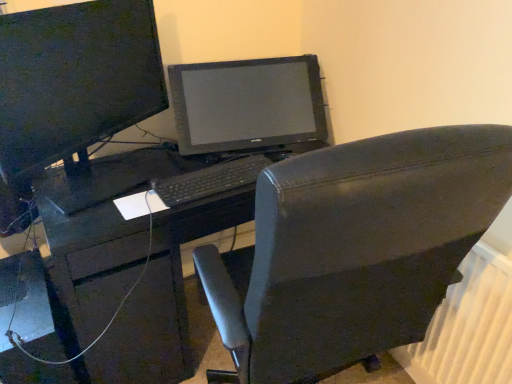
Question: Considering the relative sizes of matte black monitor at upper left and matte black desk at center in the image provided, is matte black monitor at upper left wider than matte black desk at center?

Choices:
 (A) no
 (B) yes

Answer: (A)

Question: Is matte black monitor at upper left positioned beyond the bounds of matte black desk at center?

Choices:
 (A) yes
 (B) no

Answer: (A)

Question: Is matte black monitor at upper left closer to the viewer compared to matte black desk at center?

Choices:
 (A) yes
 (B) no

Answer: (A)

Question: Considering the relative positions of matte black monitor at upper left and matte black desk at center in the image provided, is matte black monitor at upper left to the right of matte black desk at center from the viewer's perspective?

Choices:
 (A) yes
 (B) no

Answer: (B)

Question: Is matte black monitor at upper left taller than matte black desk at center?

Choices:
 (A) no
 (B) yes

Answer: (A)

Question: Is matte black monitor at upper left to the left or to the right of black plastic keyboard at center in the image?

Choices:
 (A) right
 (B) left

Answer: (B)

Question: Looking at their shapes, would you say matte black monitor at upper left is wider or thinner than black plastic keyboard at center?

Choices:
 (A) wide
 (B) thin

Answer: (A)

Question: Is matte black monitor at upper left inside or outside of black plastic keyboard at center?

Choices:
 (A) inside
 (B) outside

Answer: (B)

Question: Does point (158, 112) appear closer or farther from the camera than point (226, 183)?

Choices:
 (A) closer
 (B) farther

Answer: (B)

Question: Looking at the image, does black plastic keyboard at center seem bigger or smaller compared to black leather chair at center?

Choices:
 (A) small
 (B) big

Answer: (A)

Question: In terms of width, does black plastic keyboard at center look wider or thinner when compared to black leather chair at center?

Choices:
 (A) wide
 (B) thin

Answer: (B)

Question: Which is correct: black plastic keyboard at center is inside black leather chair at center, or outside of it?

Choices:
 (A) outside
 (B) inside

Answer: (A)

Question: Is black plastic keyboard at center to the left or to the right of black leather chair at center in the image?

Choices:
 (A) left
 (B) right

Answer: (A)

Question: From a real-world perspective, relative to black plastic keyboard at center, is white plastic radiator at lower right vertically above or below?

Choices:
 (A) above
 (B) below

Answer: (B)

Question: Which is correct: white plastic radiator at lower right is inside black plastic keyboard at center, or outside of it?

Choices:
 (A) inside
 (B) outside

Answer: (B)